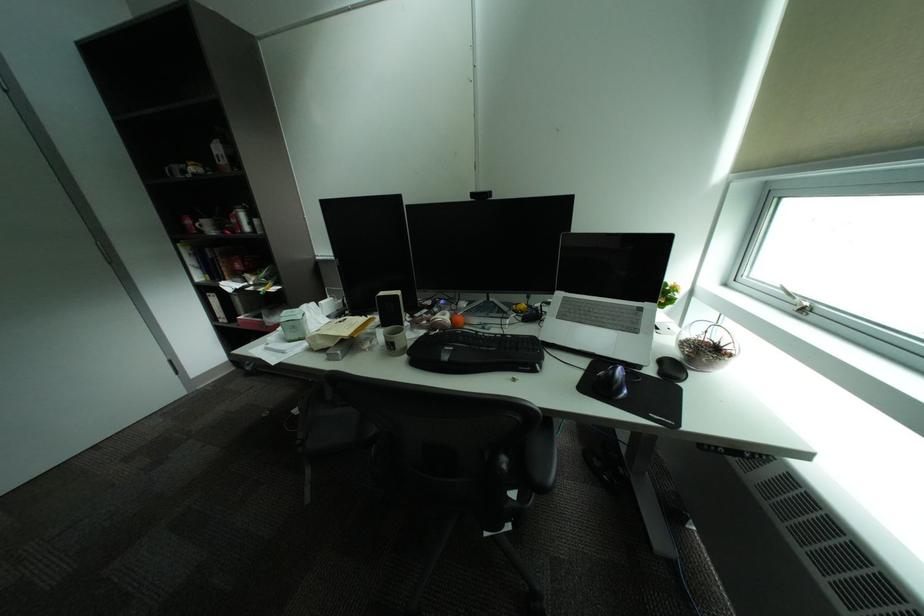
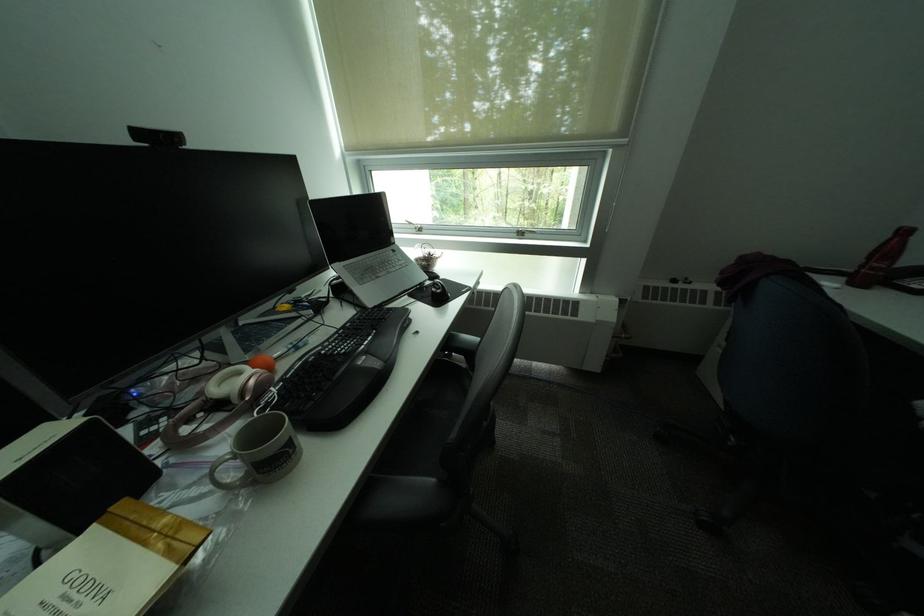
How did the camera likely rotate?

The rotation direction of the camera is right-down.